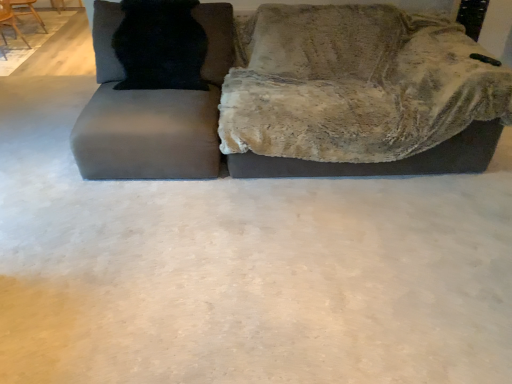
Measure the distance between point (26, 40) and camera.

Point (26, 40) is 4.57 meters away from camera.

The image size is (512, 384). What do you see at coordinates (153, 111) in the screenshot? I see `matte gray swivel chair at left` at bounding box center [153, 111].

In order to face black fur cat at upper left, should I rotate leftwards or rightwards?

You should look left and rotate roughly 12.553 degrees.

This screenshot has height=384, width=512. What do you see at coordinates (24, 10) in the screenshot?
I see `wooden chair at upper left, the 2th chair when ordered from front to back` at bounding box center [24, 10].

You are a GUI agent. You are given a task and a screenshot of the screen. Output one action in this format:
    pyautogui.click(x=<x>, y=<y>)
    Task: Click on the velvet gray couch at upper center
    The width and height of the screenshot is (512, 384).
    Given the screenshot: What is the action you would take?
    pyautogui.click(x=387, y=162)

Image resolution: width=512 pixels, height=384 pixels. Describe the element at coordinates (387, 162) in the screenshot. I see `velvet gray couch at upper center` at that location.

Identify the location of wooden chair at upper left, which ranks as the 1th chair in front-to-back order. The width and height of the screenshot is (512, 384). (9, 21).

Looking at this image, considering their positions, is velvet gray couch at upper center located in front of or behind black fur cat at upper left?

Clearly, velvet gray couch at upper center is in front of black fur cat at upper left.

The image size is (512, 384). Identify the location of studio couch below the black fur cat at upper left (from the image's perspective). (387, 162).

Looking at the image, does velvet gray couch at upper center seem bigger or smaller compared to black fur cat at upper left?

velvet gray couch at upper center is bigger than black fur cat at upper left.

Image resolution: width=512 pixels, height=384 pixels. What are the coordinates of `chair above the wooden chair at upper left, the first chair positioned from the back (from a real-world perspective)` in the screenshot? It's located at (9, 21).

Could you tell me if wooden chair at upper left, the 2th chair when ordered from front to back, is turned towards wooden chair at upper left, which ranks as the 1th chair in front-to-back order?

No, wooden chair at upper left, the 2th chair when ordered from front to back, is not turned towards wooden chair at upper left, which ranks as the 1th chair in front-to-back order.

From the image's perspective, which object appears higher, wooden chair at upper left, the 2th chair when ordered from front to back, or wooden chair at upper left, the second chair from the back?

wooden chair at upper left, the 2th chair when ordered from front to back, from the image's perspective.

Is point (167, 111) less distant than point (36, 0)?

Yes, point (167, 111) is in front of point (36, 0).

From the image's perspective, which is above, matte gray swivel chair at left or wooden chair at upper left, the 2th chair when ordered from front to back?

wooden chair at upper left, the 2th chair when ordered from front to back, is shown above in the image.

Between matte gray swivel chair at left and wooden chair at upper left, the 2th chair when ordered from front to back, which one appears on the left side from the viewer's perspective?

Positioned to the left is wooden chair at upper left, the 2th chair when ordered from front to back.

Based on their sizes in the image, would you say matte gray swivel chair at left is bigger or smaller than wooden chair at upper left, which ranks as the 1th chair in front-to-back order?

matte gray swivel chair at left is bigger than wooden chair at upper left, which ranks as the 1th chair in front-to-back order.

Relative to wooden chair at upper left, the second chair from the back, is matte gray swivel chair at left in front or behind?

In the image, matte gray swivel chair at left appears in front of wooden chair at upper left, the second chair from the back.

Is matte gray swivel chair at left inside the boundaries of wooden chair at upper left, which ranks as the 1th chair in front-to-back order, or outside?

matte gray swivel chair at left lies outside wooden chair at upper left, which ranks as the 1th chair in front-to-back order.

Looking at this image, is matte gray swivel chair at left to the left or to the right of wooden chair at upper left, the second chair from the back, in the image?

From the image, it's evident that matte gray swivel chair at left is to the right of wooden chair at upper left, the second chair from the back.

Between wooden chair at upper left, the 2th chair when ordered from front to back, and matte gray swivel chair at left, which one has smaller width?

wooden chair at upper left, the 2th chair when ordered from front to back, is thinner.

Considering the sizes of wooden chair at upper left, the first chair positioned from the back, and matte gray swivel chair at left in the image, is wooden chair at upper left, the first chair positioned from the back, taller or shorter than matte gray swivel chair at left?

Clearly, wooden chair at upper left, the first chair positioned from the back, is shorter compared to matte gray swivel chair at left.

Starting from the matte gray swivel chair at left, which chair is the 2nd one to the left? Please provide its 2D coordinates.

[(24, 10)]

From a real-world perspective, is wooden chair at upper left, the 2th chair when ordered from front to back, positioned over matte gray swivel chair at left based on gravity?

Incorrect, from a real-world perspective, wooden chair at upper left, the 2th chair when ordered from front to back, is lower than matte gray swivel chair at left.

Considering the points (10, 20) and (74, 132), which point is behind, point (10, 20) or point (74, 132)?

Point (10, 20)

Where is `chair that is the 1st one when counting backward from the matte gray swivel chair at left`? Image resolution: width=512 pixels, height=384 pixels. chair that is the 1st one when counting backward from the matte gray swivel chair at left is located at coordinates (9, 21).

Could you tell me if wooden chair at upper left, the second chair from the back, is facing matte gray swivel chair at left?

No, wooden chair at upper left, the second chair from the back, is not oriented towards matte gray swivel chair at left.

From a real-world perspective, does wooden chair at upper left, the second chair from the back, sit lower than matte gray swivel chair at left?

Correct, in the physical world, wooden chair at upper left, the second chair from the back, is lower than matte gray swivel chair at left.

Looking at this image, are wooden chair at upper left, the first chair positioned from the back, and black fur cat at upper left making contact?

No.

How far apart are wooden chair at upper left, the first chair positioned from the back, and black fur cat at upper left?

wooden chair at upper left, the first chair positioned from the back, is 11.30 feet from black fur cat at upper left.

Between wooden chair at upper left, the first chair positioned from the back, and black fur cat at upper left, which one is positioned in front?

black fur cat at upper left is in front.

From the image's perspective, which object appears higher, wooden chair at upper left, the first chair positioned from the back, or black fur cat at upper left?

wooden chair at upper left, the first chair positioned from the back.

This screenshot has height=384, width=512. In order to click on studio couch that appears below the black fur cat at upper left (from the image's perspective) in this screenshot , I will do `click(387, 162)`.

Identify the location of chair on the right of wooden chair at upper left, the first chair positioned from the back. This screenshot has height=384, width=512. (9, 21).

Based on their spatial positions, is velvet gray couch at upper center or wooden chair at upper left, the first chair positioned from the back, closer to wooden chair at upper left, which ranks as the 1th chair in front-to-back order?

wooden chair at upper left, the first chair positioned from the back, lies closer to wooden chair at upper left, which ranks as the 1th chair in front-to-back order, than the other object.

Considering their positions, is wooden chair at upper left, the first chair positioned from the back, positioned closer to black fur cat at upper left than velvet gray couch at upper center?

Among the two, velvet gray couch at upper center is located nearer to black fur cat at upper left.

Considering their positions, is wooden chair at upper left, the 2th chair when ordered from front to back, positioned further to matte gray swivel chair at left than black fur cat at upper left?

The object further to matte gray swivel chair at left is wooden chair at upper left, the 2th chair when ordered from front to back.

When comparing their distances from velvet gray couch at upper center, does wooden chair at upper left, the second chair from the back, or black fur cat at upper left seem further?

wooden chair at upper left, the second chair from the back, lies further to velvet gray couch at upper center than the other object.

Which object lies further to the anchor point wooden chair at upper left, the first chair positioned from the back, matte gray swivel chair at left or wooden chair at upper left, the second chair from the back?

The object further to wooden chair at upper left, the first chair positioned from the back, is matte gray swivel chair at left.

From the image, which object appears to be farther from wooden chair at upper left, the second chair from the back, black fur cat at upper left or wooden chair at upper left, the 2th chair when ordered from front to back?

black fur cat at upper left is positioned further to the anchor wooden chair at upper left, the second chair from the back.

From the image, which object appears to be nearer to velvet gray couch at upper center, wooden chair at upper left, which ranks as the 1th chair in front-to-back order, or wooden chair at upper left, the 2th chair when ordered from front to back?

The object closer to velvet gray couch at upper center is wooden chair at upper left, which ranks as the 1th chair in front-to-back order.

From the image, which object appears to be nearer to matte gray swivel chair at left, black fur cat at upper left or velvet gray couch at upper center?

black fur cat at upper left is closer to matte gray swivel chair at left.

Locate an element on the screen. Image resolution: width=512 pixels, height=384 pixels. cat between wooden chair at upper left, the second chair from the back, and velvet gray couch at upper center from left to right is located at coordinates pyautogui.click(x=160, y=45).

Locate an element on the screen. The image size is (512, 384). chair located between black fur cat at upper left and wooden chair at upper left, the first chair positioned from the back, in the depth direction is located at coordinates (9, 21).

Where is `chair between matte gray swivel chair at left and wooden chair at upper left, the first chair positioned from the back, in the front-back direction`? chair between matte gray swivel chair at left and wooden chair at upper left, the first chair positioned from the back, in the front-back direction is located at coordinates (9, 21).

At what (x,y) coordinates should I click in order to perform the action: click on swivel chair between black fur cat at upper left and velvet gray couch at upper center in the horizontal direction. Please return your answer as a coordinate pair (x, y). This screenshot has height=384, width=512. Looking at the image, I should click on (153, 111).